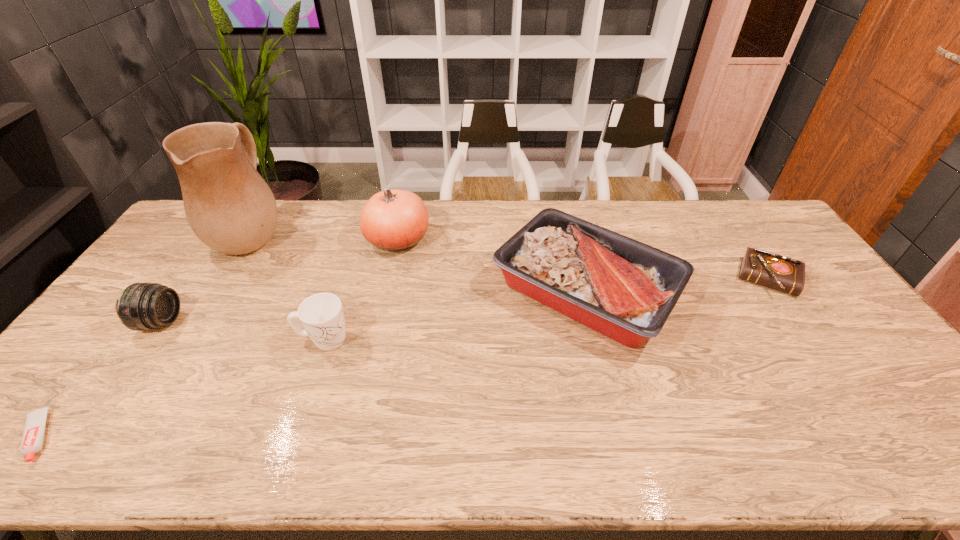
Image resolution: width=960 pixels, height=540 pixels. In order to click on vacant space in between the telephoto lens and the sixth tallest object in this screenshot , I will do `click(465, 300)`.

You are a GUI agent. You are given a task and a screenshot of the screen. Output one action in this format:
    pyautogui.click(x=<x>, y=<y>)
    Task: Click on the vacant area that lies between the tallest object and the sixth object from left to right
    
    Given the screenshot: What is the action you would take?
    pyautogui.click(x=420, y=262)

Identify which object is located as the third nearest to the toothpaste. Please provide its 2D coordinates. Your answer should be formatted as a tuple, i.e. [(x, y)], where the tuple contains the x and y coordinates of a point satisfying the conditions above.

[(230, 208)]

Select which object is the sixth closest to the telephoto lens. Please provide its 2D coordinates. Your answer should be formatted as a tuple, i.e. [(x, y)], where the tuple contains the x and y coordinates of a point satisfying the conditions above.

[(781, 273)]

Where is `free region that satisfies the following two spatial constraints: 1. at the spout of the cream pitcher; 2. on the right side of the second tallest object`? The width and height of the screenshot is (960, 540). free region that satisfies the following two spatial constraints: 1. at the spout of the cream pitcher; 2. on the right side of the second tallest object is located at coordinates (248, 240).